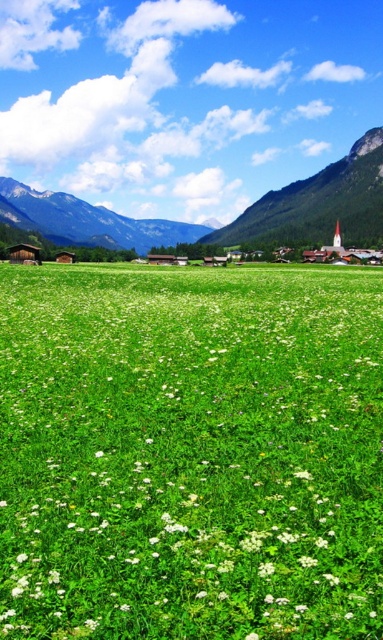
Does white matte flower at center have a lesser width compared to green rocky mountain at upper right?

Yes.

Where is `white matte flower at center`? The width and height of the screenshot is (383, 640). white matte flower at center is located at coordinates (189, 454).

This screenshot has height=640, width=383. I want to click on white matte flower at center, so click(x=189, y=454).

Which is below, white matte flower at center or green grassy mountain at upper left?

white matte flower at center is below.

Is white matte flower at center thinner than green grassy mountain at upper left?

Indeed, white matte flower at center has a lesser width compared to green grassy mountain at upper left.

Measure the distance between white matte flower at center and camera.

They are 5.47 meters apart.

Image resolution: width=383 pixels, height=640 pixels. I want to click on white matte flower at center, so click(x=189, y=454).

In the scene shown: Is green rocky mountain at upper right to the left of green grassy mountain at upper left from the viewer's perspective?

Incorrect, green rocky mountain at upper right is not on the left side of green grassy mountain at upper left.

What do you see at coordinates (317, 202) in the screenshot?
I see `green rocky mountain at upper right` at bounding box center [317, 202].

Locate an element on the screen. green rocky mountain at upper right is located at coordinates pyautogui.click(x=317, y=202).